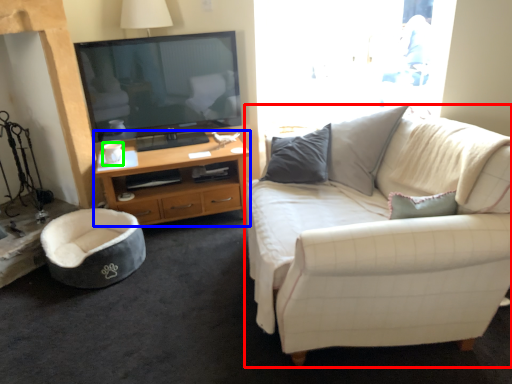
Question: Which object is the closest to the studio couch (highlighted by a red box)? Choose among these: desk (highlighted by a blue box) or coffee cup (highlighted by a green box).

Choices:
 (A) desk
 (B) coffee cup

Answer: (A)